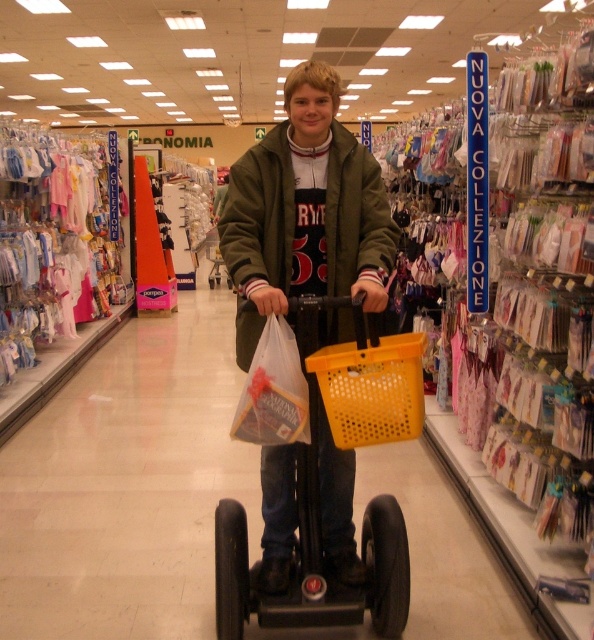
Question: Can you confirm if yellow plastic scooter at center is smaller than yellow plastic basket at center?

Choices:
 (A) no
 (B) yes

Answer: (A)

Question: From the image, what is the correct spatial relationship of yellow plastic scooter at center in relation to yellow plastic basket at center?

Choices:
 (A) above
 (B) below

Answer: (B)

Question: Where is yellow plastic scooter at center located in relation to yellow plastic basket at center in the image?

Choices:
 (A) left
 (B) right

Answer: (A)

Question: Among these points, which one is farthest from the camera?

Choices:
 (A) (245, 573)
 (B) (387, 413)

Answer: (A)

Question: Which point is closer to the camera?

Choices:
 (A) (393, 404)
 (B) (375, 522)

Answer: (A)